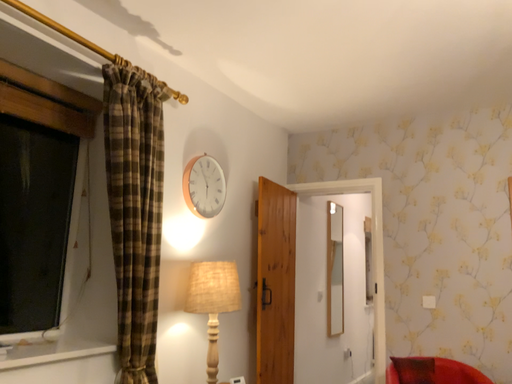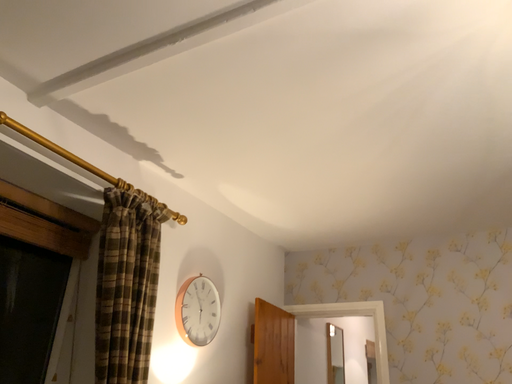
Question: Which way did the camera rotate in the video?

Choices:
 (A) rotated downward
 (B) rotated upward

Answer: (B)